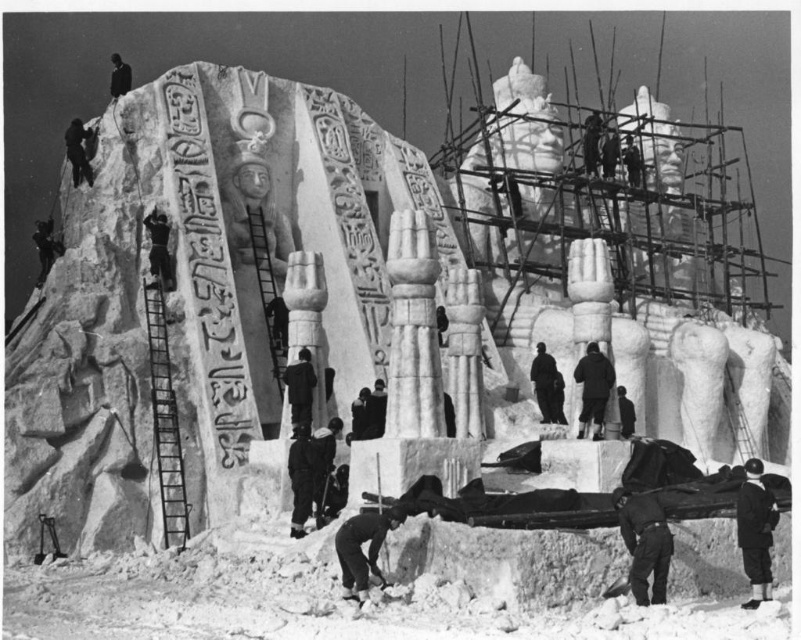
Who is more forward, (634,550) or (763,493)?

A: Point (634,550)

Is dark gray uniform at lower right wider than black fabric at lower right?

No, dark gray uniform at lower right is not wider than black fabric at lower right.

Locate an element on the screen. dark gray uniform at lower right is located at coordinates (643, 544).

Is dark gray stone figure at center positioned in front of black matte person at upper left?

Yes, it is.

Can you confirm if dark gray stone figure at center is positioned to the left of black matte person at upper left?

No, dark gray stone figure at center is not to the left of black matte person at upper left.

Between point (379, 540) and point (115, 92), which one is positioned in front?

Point (379, 540) is in front.

The image size is (801, 640). What are the coordinates of `dark gray stone figure at center` in the screenshot? It's located at (361, 548).

Between black matte person at center and black fabric at upper left, which one has less height?

Standing shorter between the two is black matte person at center.

Which is behind, point (550, 368) or point (75, 180)?

Positioned behind is point (75, 180).

I want to click on black matte person at center, so click(x=544, y=381).